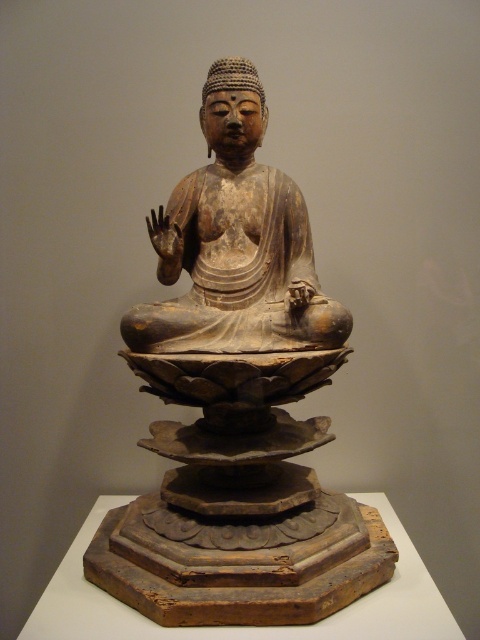
You are an art conservator examining the Buddha statue. You notice two points on the statue that need restoration. One is at point (262, 250) and the other at point (255, 125). From your vantage point, which point is closer to you?

Point (255, 125) is closer to you since it is in front of point (262, 250), which is behind it.

What is located at the coordinates point (238, 401) in the image?

The matte brown wood statue at center is located at point (238, 401).